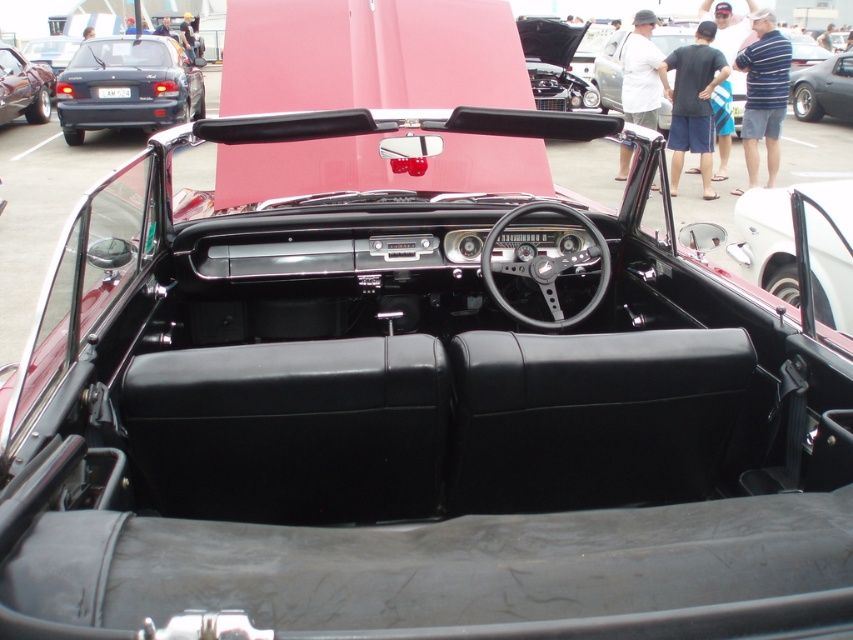
Consider the image. You are a passenger in the shiny white door at right and want to exit the car. The matte black sedan at upper left is blocking your way. Can you exit without moving the sedan?

The shiny white door at right is located below the matte black sedan at upper left, meaning the sedan is positioned above it. Since the sedan is part of the car itself, you can exit by opening the shiny white door at right as the sedan isn

You are standing at the camera position and want to take a photo of the shiny black car at upper right. Considering the car is 13.88 meters away, will it be possible to capture the entire car in a single photo without moving?

The shiny black car at upper right is 13.88 meters away from the camera. Whether it can be captured entirely depends on the camera lens used. A standard lens might require moving closer, but a wide angle lens could potentially capture the entire car from that distance.

You are a passenger in the classic convertible car shown. You want to get out of the car. The door is located at the point indicated by point (x=126, y=86). Is the door on the left side or the right side of the car?

The point (x=126, y=86) indicates the matte black sedan at upper left, so the door is on the left side of the car.